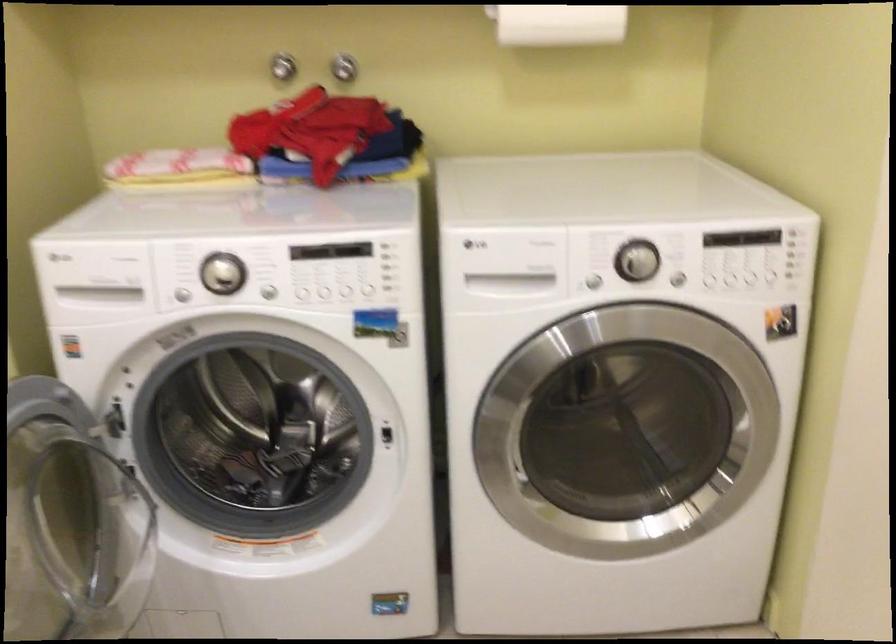
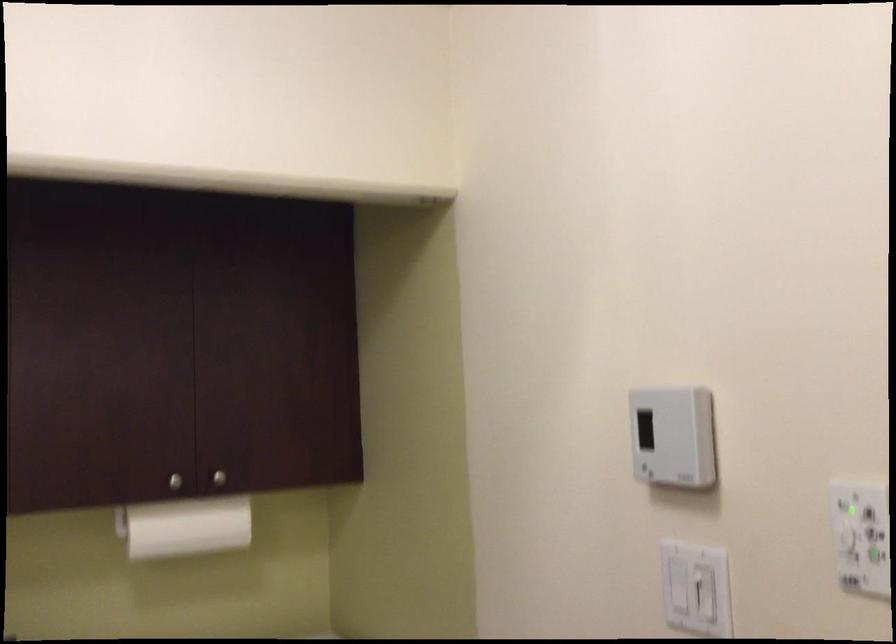
The first image is from the beginning of the video and the second image is from the end. How did the camera likely rotate when shooting the video?

The rotation direction of the camera is right-up.